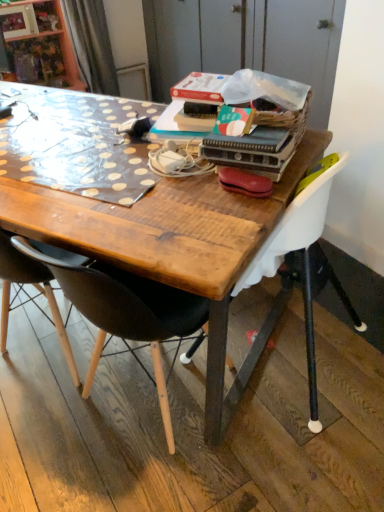
Identify the location of unoccupied area in front of leather-like brown handbag at center. This screenshot has width=384, height=512. (229, 217).